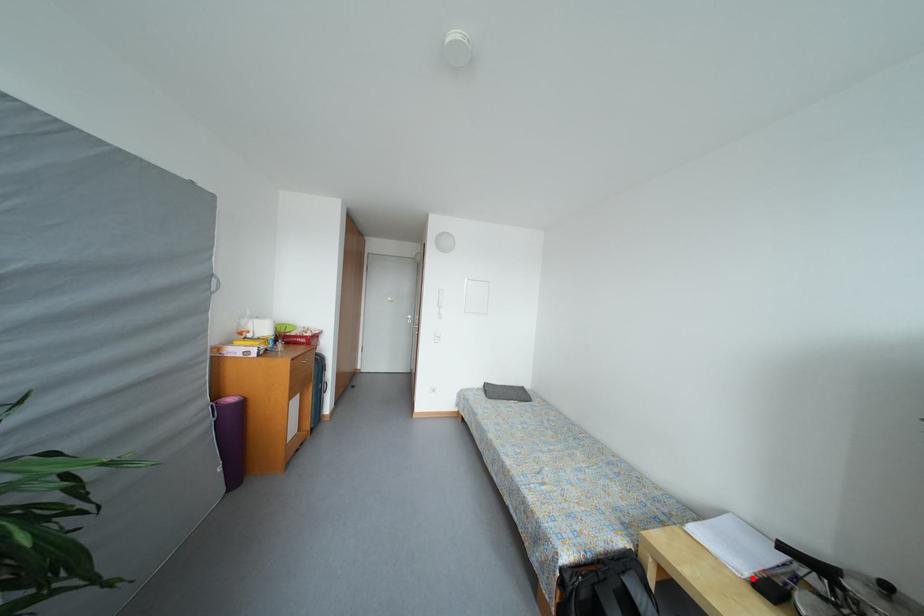
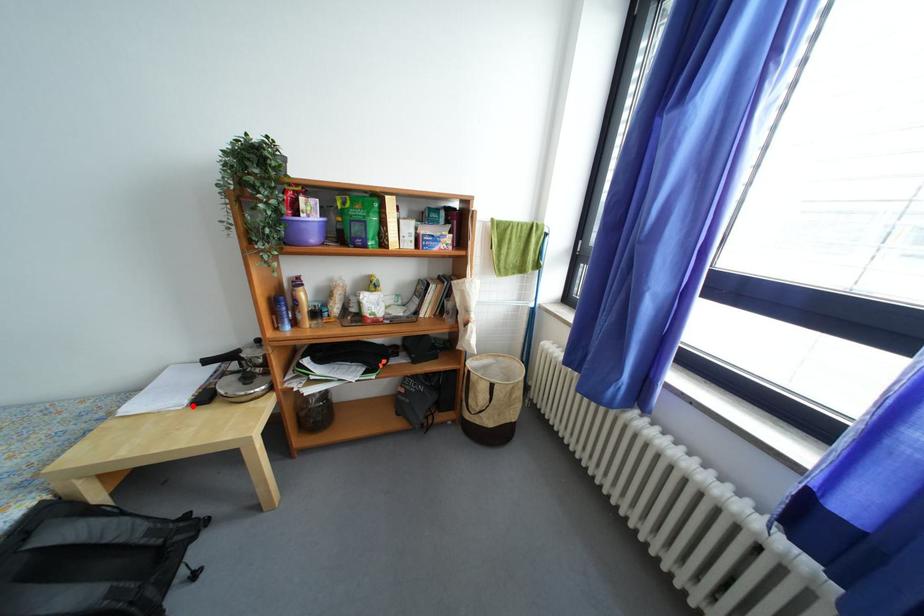
Looking at this image, I am providing you with two images of the same scene from different viewpoints. A red point is marked on the first image and another point is marked on the second image. Is the marked point in image1 the same physical position as the marked point in image2?

Yes